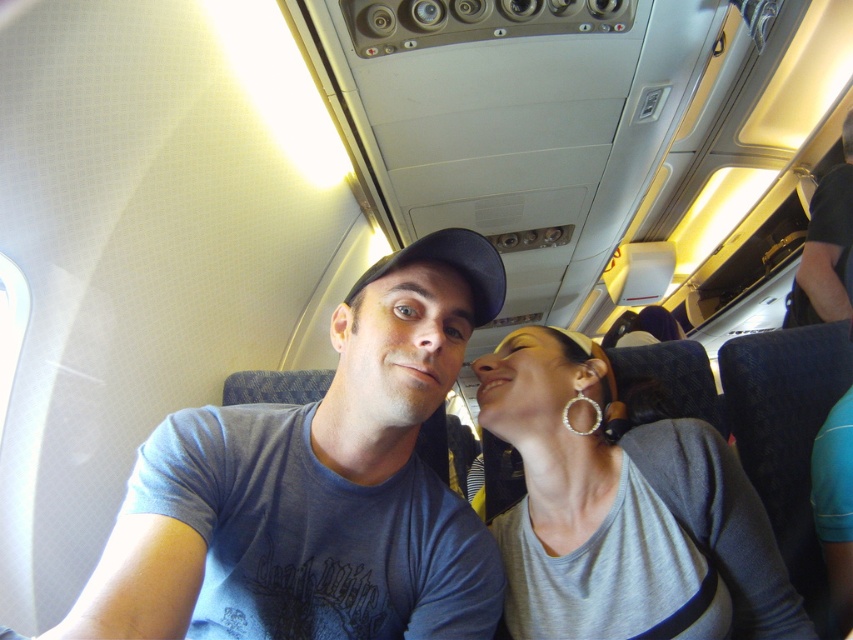
Is blue cotton t-shirt at center further to the viewer compared to gray matte shirt at upper right?

No, it is not.

Is blue cotton t-shirt at center to the right of gray matte shirt at upper right from the viewer's perspective?

Incorrect, blue cotton t-shirt at center is not on the right side of gray matte shirt at upper right.

Which is behind, point (343, 422) or point (747, 577)?

Positioned behind is point (747, 577).

The width and height of the screenshot is (853, 640). I want to click on blue cotton t-shirt at center, so click(x=317, y=486).